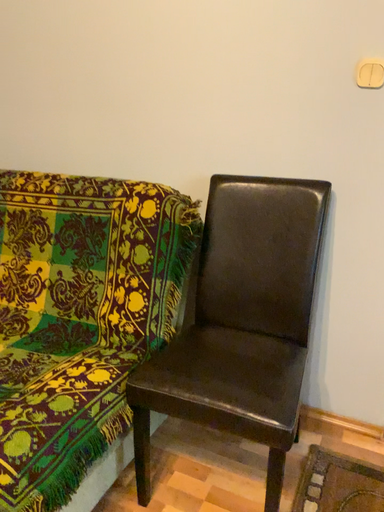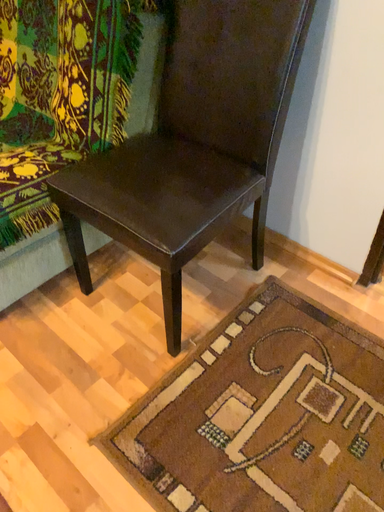
Question: How did the camera likely rotate when shooting the video?

Choices:
 (A) rotated downward
 (B) rotated upward

Answer: (A)